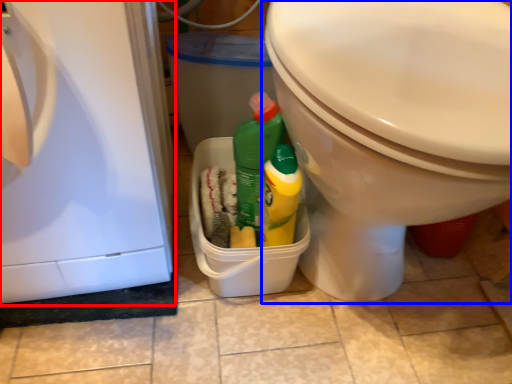
Question: Which object appears closest to the camera in this image, dish washer (highlighted by a red box) or toilet (highlighted by a blue box)?

Choices:
 (A) dish washer
 (B) toilet

Answer: (A)